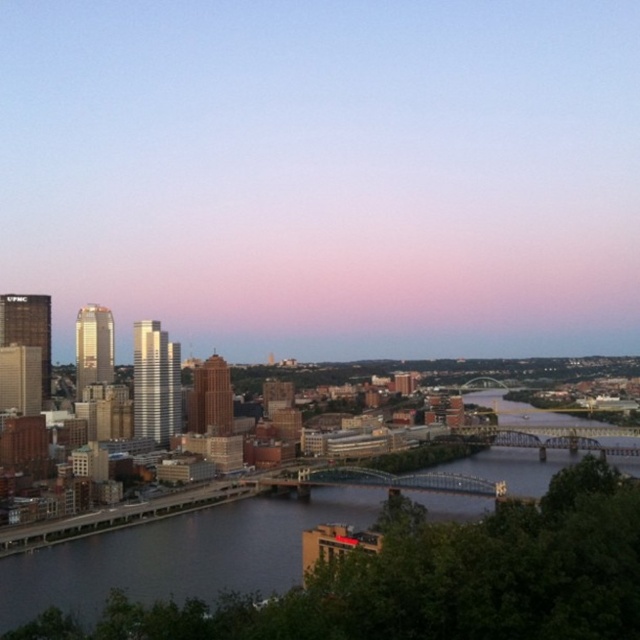
Who is higher up, pink gradient sky at upper center or dark blue water at center?

pink gradient sky at upper center is higher up.

Which is more to the left, pink gradient sky at upper center or dark blue water at center?

Positioned to the left is pink gradient sky at upper center.

Is point (138, 204) less distant than point (198, 556)?

That is False.

At what (x,y) coordinates should I click in order to perform the action: click on pink gradient sky at upper center. Please return your answer as a coordinate pair (x, y). The image size is (640, 640). Looking at the image, I should click on (326, 172).